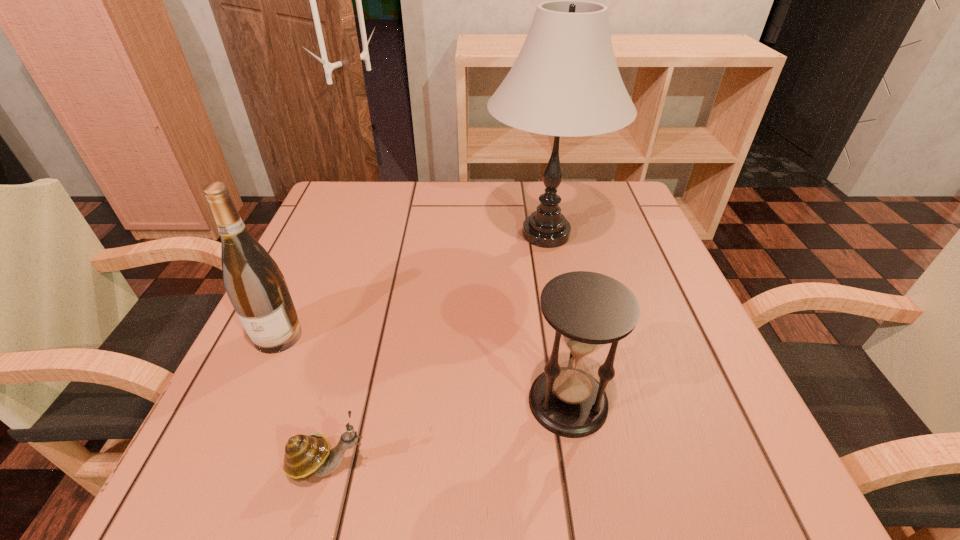
I want to click on vacant space at the far edge of the desktop, so click(384, 227).

The width and height of the screenshot is (960, 540). In the image, there is a desktop. In order to click on vacant space at the near edge in this screenshot , I will do `click(512, 453)`.

You are a GUI agent. You are given a task and a screenshot of the screen. Output one action in this format:
    pyautogui.click(x=<x>, y=<y>)
    Task: Click on the vacant space at the left edge of the desktop
    This screenshot has width=960, height=540.
    Given the screenshot: What is the action you would take?
    (259, 387)

In the image, there is a desktop. Find the location of `free space at the right edge`. free space at the right edge is located at coordinates (639, 306).

The image size is (960, 540). I want to click on free location at the far right corner, so click(x=631, y=194).

Locate an element on the screen. The height and width of the screenshot is (540, 960). vacant region at the near right corner of the desktop is located at coordinates (726, 491).

The height and width of the screenshot is (540, 960). I want to click on free point between the leftmost object and the second shortest object, so click(x=423, y=369).

Find the location of a particular element. This screenshot has width=960, height=540. free point between the nearest object and the leftmost object is located at coordinates (302, 400).

I want to click on vacant space that is in between the nearest object and the second shortest object, so click(x=447, y=433).

At what (x,y) coordinates should I click in order to perform the action: click on vacant region between the wine bottle and the hourglass. Please return your answer as a coordinate pair (x, y). Image resolution: width=960 pixels, height=540 pixels. Looking at the image, I should click on (423, 369).